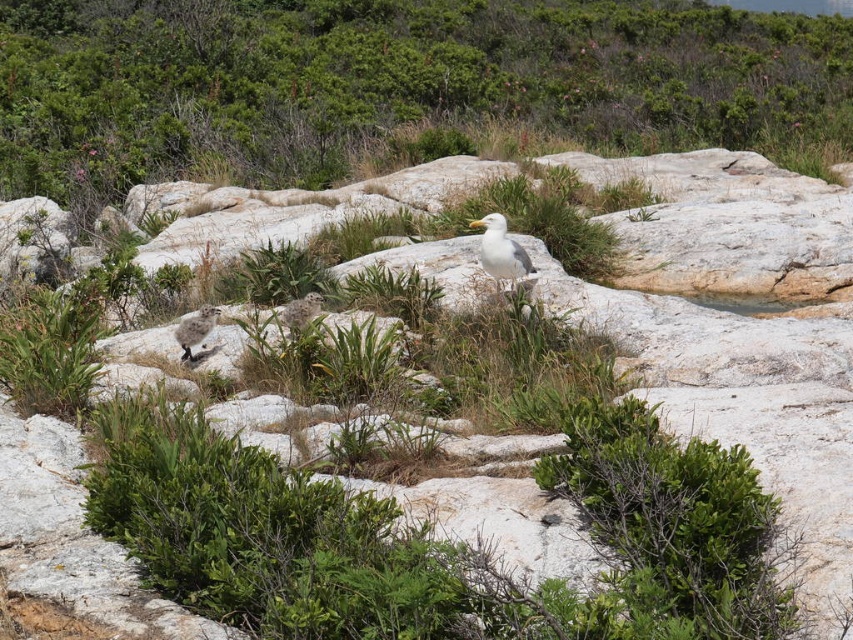
Who is more distant from viewer, (502, 221) or (296, 330)?

Positioned behind is point (502, 221).

Between white feathered bird at center and white fluffy bird at center, which one appears on the left side from the viewer's perspective?

From the viewer's perspective, white fluffy bird at center appears more on the left side.

Does point (509, 273) lie in front of point (320, 301)?

No, it is behind (320, 301).

Where is `white feathered bird at center`? Image resolution: width=853 pixels, height=640 pixels. white feathered bird at center is located at coordinates (503, 253).

Which is in front, point (532, 282) or point (212, 314)?

Positioned in front is point (212, 314).

Which is behind, point (527, 273) or point (186, 346)?

The point (527, 273) is more distant.

Image resolution: width=853 pixels, height=640 pixels. What do you see at coordinates (503, 253) in the screenshot? I see `white feathered bird at center` at bounding box center [503, 253].

At what (x,y) coordinates should I click in order to perform the action: click on white feathered bird at center. Please return your answer as a coordinate pair (x, y). The height and width of the screenshot is (640, 853). Looking at the image, I should click on (503, 253).

Is green leafy shrubs at upper center in front of white fluffy bird at center?

No, green leafy shrubs at upper center is behind white fluffy bird at center.

Find the location of a particular element. green leafy shrubs at upper center is located at coordinates (390, 80).